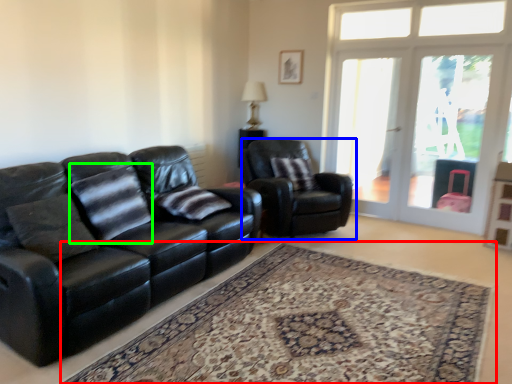
Question: Which object is the farthest from plain (highlighted by a red box)? Choose among these: chair (highlighted by a blue box) or pillow (highlighted by a green box).

Choices:
 (A) chair
 (B) pillow

Answer: (A)